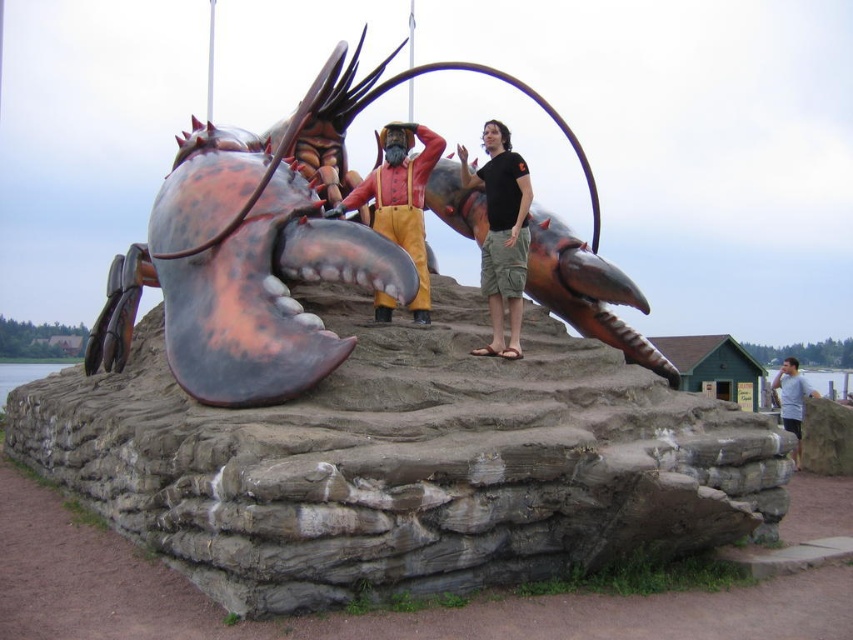
Question: From the image, what is the correct spatial relationship of black cotton shirt at center in relation to gray cotton shirt at lower right?

Choices:
 (A) left
 (B) right

Answer: (A)

Question: Among these points, which one is nearest to the camera?

Choices:
 (A) (434, 132)
 (B) (445, 202)
 (C) (136, 408)

Answer: (C)

Question: Which point appears farthest from the camera in this image?

Choices:
 (A) (469, 172)
 (B) (782, 385)

Answer: (B)

Question: Is black cotton shirt at center closer to camera compared to reddish-brown leather boots at center?

Choices:
 (A) yes
 (B) no

Answer: (B)

Question: Is black cotton shirt at center smaller than gray cotton shirt at lower right?

Choices:
 (A) no
 (B) yes

Answer: (B)

Question: Estimate the real-world distances between objects in this image. Which object is farther from the metallic lobster at center?

Choices:
 (A) rustic stone base at center
 (B) black cotton shirt at center

Answer: (B)